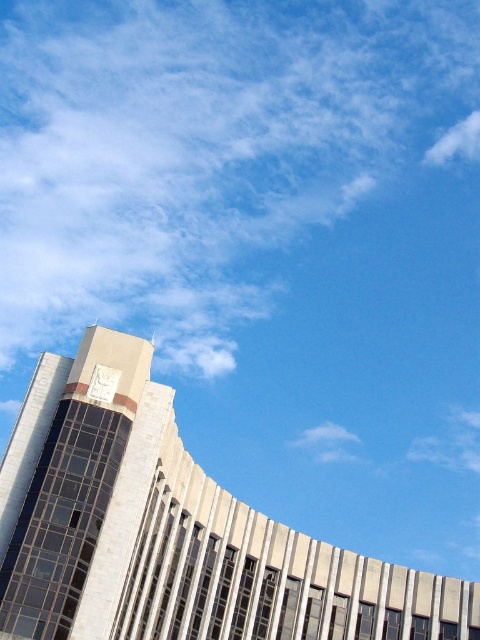
Looking at this image, which is more to the right, white stone tower at upper left or white fluffy cloud at upper right?

white fluffy cloud at upper right is more to the right.

Can you confirm if white stone tower at upper left is thinner than white fluffy cloud at upper right?

Incorrect, white stone tower at upper left's width is not less than white fluffy cloud at upper right's.

What do you see at coordinates (172, 532) in the screenshot?
I see `white stone tower at upper left` at bounding box center [172, 532].

Find the location of a particular element. white stone tower at upper left is located at coordinates (172, 532).

Does white fluffy cloud at upper center appear on the left side of white stone tower at upper left?

Indeed, white fluffy cloud at upper center is positioned on the left side of white stone tower at upper left.

Does white fluffy cloud at upper center appear under white stone tower at upper left?

No.

Which is in front, point (355, 164) or point (35, 436)?

Point (35, 436) is more forward.

The width and height of the screenshot is (480, 640). What are the coordinates of `white fluffy cloud at upper center` in the screenshot? It's located at (202, 150).

Is white fluffy cloud at upper center wider than metallic clock at upper left?

Yes, white fluffy cloud at upper center is wider than metallic clock at upper left.

Find the location of a particular element. white fluffy cloud at upper center is located at coordinates (202, 150).

Image resolution: width=480 pixels, height=640 pixels. In order to click on white fluffy cloud at upper center in this screenshot , I will do `click(202, 150)`.